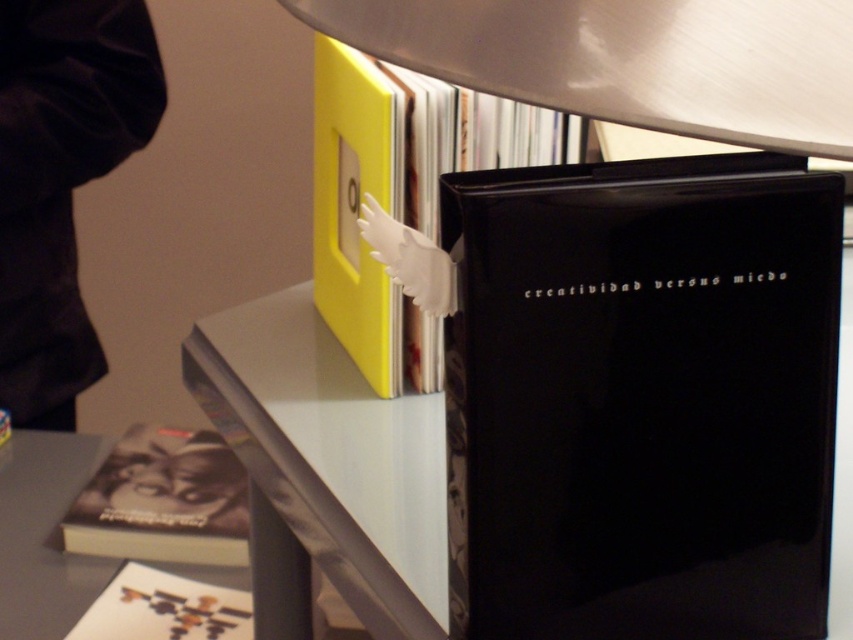
Question: Which point is closer to the camera?

Choices:
 (A) (437, 148)
 (B) (128, 22)
 (C) (135, 483)
 (D) (824, 388)

Answer: (D)

Question: Is black glossy book at center positioned before matte black book at lower left?

Choices:
 (A) no
 (B) yes

Answer: (B)

Question: Among these points, which one is farthest from the camera?

Choices:
 (A) (149, 28)
 (B) (190, 614)
 (C) (363, 260)

Answer: (A)

Question: Is black velvet jacket at upper left bigger than yellow matte book at upper center?

Choices:
 (A) yes
 (B) no

Answer: (A)

Question: Estimate the real-world distances between objects in this image. Which object is closer to the yellow matte book at upper center?

Choices:
 (A) matte black book at lower left
 (B) black glossy book at center
 (C) black velvet jacket at upper left

Answer: (B)

Question: Does black velvet jacket at upper left come behind black matte book at lower left?

Choices:
 (A) yes
 (B) no

Answer: (A)